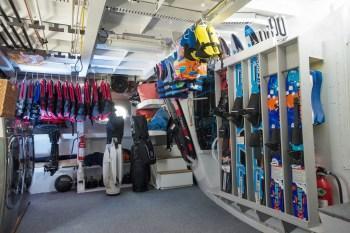
Where is `fire extinguisher`? fire extinguisher is located at coordinates (324, 187).